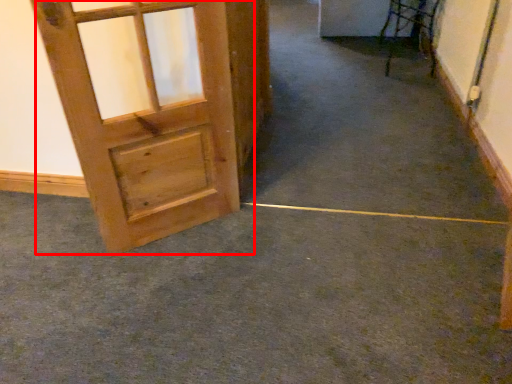
Question: From the image, what is the correct spatial relationship of door (annotated by the red box) in relation to concrete?

Choices:
 (A) left
 (B) right

Answer: (A)